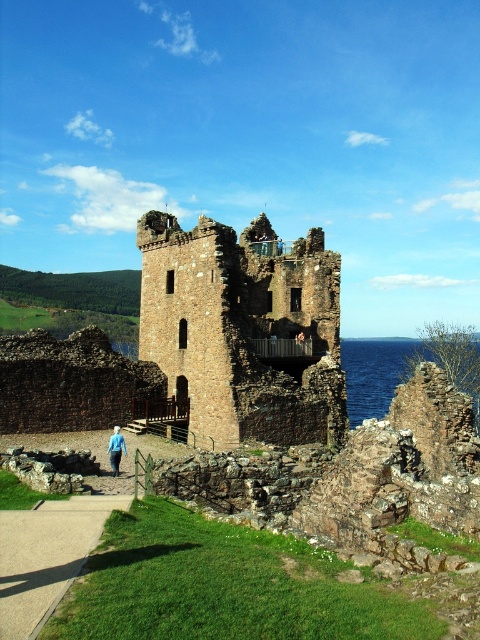
Can you confirm if gravel path at lower left is bigger than blue denim jacket at lower left?

Incorrect, gravel path at lower left is not larger than blue denim jacket at lower left.

Who is positioned more to the right, gravel path at lower left or blue denim jacket at lower left?

Positioned to the right is gravel path at lower left.

Who is more forward, (19,538) or (120,456)?

Point (19,538) is in front.

You are a GUI agent. You are given a task and a screenshot of the screen. Output one action in this format:
    pyautogui.click(x=<x>, y=<y>)
    Task: Click on the gravel path at lower left
    
    Given the screenshot: What is the action you would take?
    pyautogui.click(x=46, y=556)

Who is lower down, brown stone tower at center or blue denim jacket at lower left?

Positioned lower is blue denim jacket at lower left.

Which is behind, point (166, 246) or point (112, 465)?

The point (166, 246) is behind.

Locate an element on the screen. Image resolution: width=480 pixels, height=640 pixels. brown stone tower at center is located at coordinates (243, 328).

Who is positioned more to the left, blue liquid water at right or blue denim jacket at lower left?

blue denim jacket at lower left is more to the left.

Is blue liquid water at right closer to camera compared to blue denim jacket at lower left?

No, it is behind blue denim jacket at lower left.

Is point (415, 339) behind point (115, 435)?

Yes.

Find the location of a particular element. The height and width of the screenshot is (640, 480). blue liquid water at right is located at coordinates (373, 372).